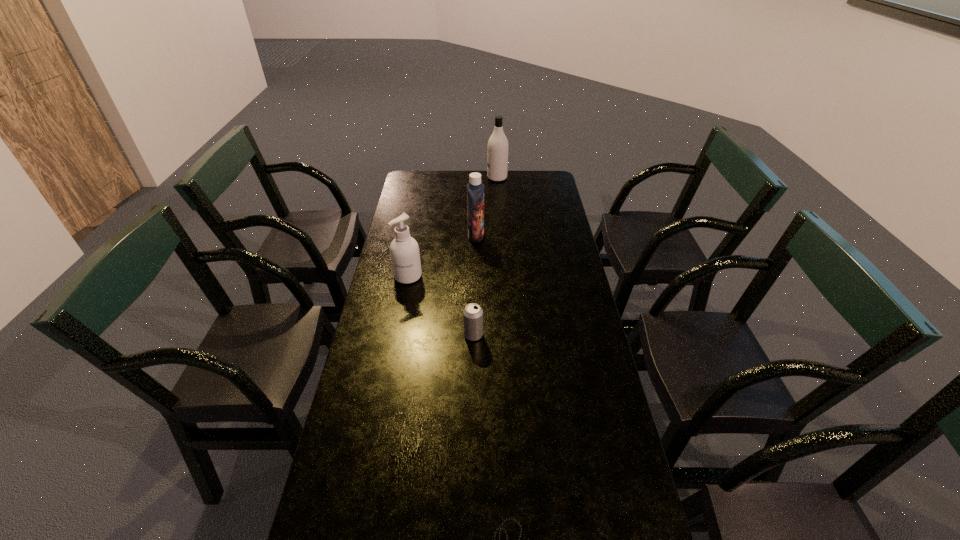
Where is `vacant area located 0.220m on the front-facing side of the right shampoo`? The height and width of the screenshot is (540, 960). vacant area located 0.220m on the front-facing side of the right shampoo is located at coordinates (443, 178).

The width and height of the screenshot is (960, 540). I want to click on vacant space located 0.170m on the front label of the left shampoo, so click(x=525, y=236).

The image size is (960, 540). Identify the location of vacant space located on the front label of the cleansing agent. (395, 346).

I want to click on blank space located on the front of the beer can, so click(473, 366).

Identify the location of object present at the far edge. This screenshot has height=540, width=960. (497, 150).

Locate an element on the screen. The image size is (960, 540). object positioned at the left edge is located at coordinates (404, 251).

Image resolution: width=960 pixels, height=540 pixels. In the image, there is a desktop. What are the coordinates of `free space at the far edge` in the screenshot? It's located at (492, 185).

In the image, there is a desktop. Identify the location of vacant space at the left edge. (428, 235).

Find the location of `vacant space at the right edge of the desktop`. vacant space at the right edge of the desktop is located at coordinates (579, 495).

Image resolution: width=960 pixels, height=540 pixels. Find the location of `vacant space at the far left corner of the desktop`. vacant space at the far left corner of the desktop is located at coordinates (414, 178).